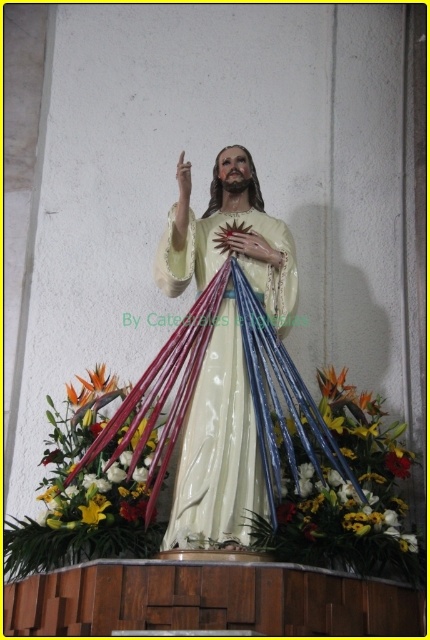
You are standing in front of the statue and want to place a small offering on the white glossy petals at lower center. Since you can only reach up to the height of the matte porcelain statue at center, will you be able to place the offering without needing a step stool?

The matte porcelain statue at center is closer to the viewer than the white glossy petals at lower center. Since the petals are further away and you can only reach up to the statue height, you would need to move closer or use a step stool to place the offering on the white glossy petals at lower center.

Looking at this image, you are an interior designer planning to place a small decorative item on the floor in front of the statue. The item you have is 10 cm in diameter. Considering the existing objects, will there be enough space between the vibrant floral bouquet at center and the white glossy petals at lower center to place your item?

The vibrant floral bouquet at center is larger in size than the white glossy petals at lower center. However, without specific distance information between them, it is uncertain if there is enough space for the 10 cm decorative item. Further measurements are needed.

You are standing in front of the statue and want to place a small candle on the right side of the statue. However, there is a floral bouquet nearby. Based on the scene description, can you determine if there is enough space to place the candle to the right of the matte porcelain statue at center without moving the vibrant floral bouquet at center?

The matte porcelain statue at center is to the left of vibrant floral bouquet at center, meaning the bouquet is on the right side of the statue. Since the floral bouquet is already positioned to the right of the statue, there is no space available to place the candle there without moving the bouquet.